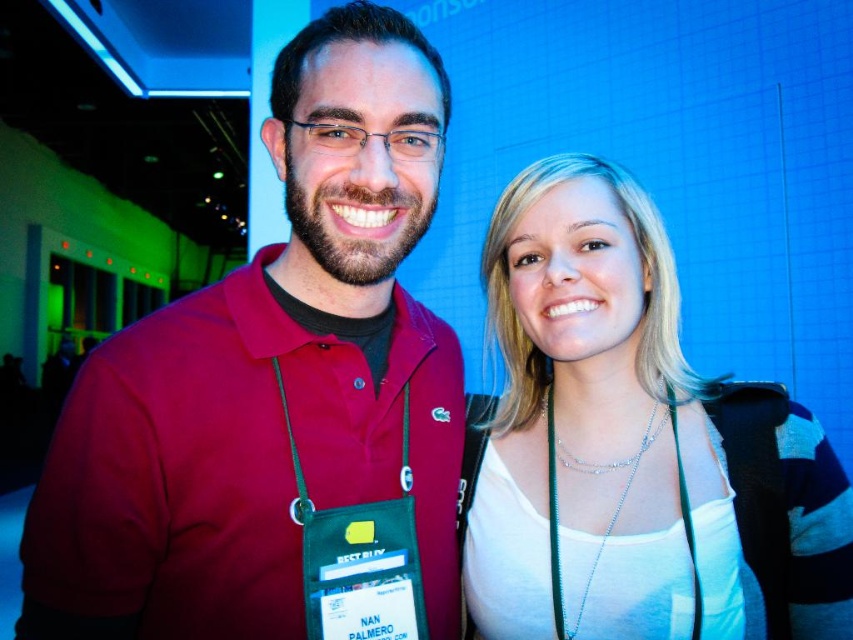
You are a photographer adjusting your camera settings. You notice the matte red polo shirt at center and the silver chain lanyard at center in the frame. Which object is positioned closer to the camera?

The matte red polo shirt at center is closer to the viewer than the silver chain lanyard at center, so the matte red polo shirt at center is positioned closer to the camera.

You are an event planner arranging a photo shoot for two people. You need to ensure that the matte red polo shirt at center and the white matte tank top at center are visible in the final image. Based on their positions, which clothing item will appear higher in the photo?

The matte red polo shirt at center will appear higher in the photo because it is positioned above the white matte tank top at center.

You are a photographer setting up for a group photo. You notice the white matte tank top at center and the silver chain lanyard at center. Which item is more visible to the camera from the current angle?

The white matte tank top at center is positioned over the silver chain lanyard at center, so the white matte tank top at center is more visible to the camera from the current angle.